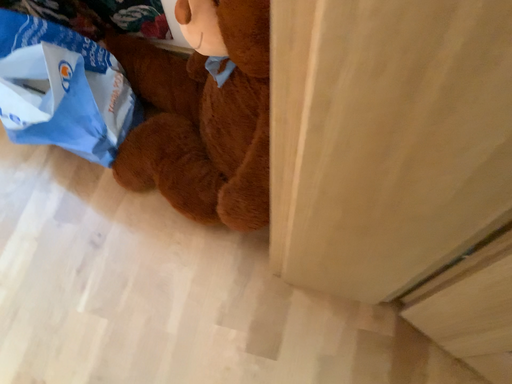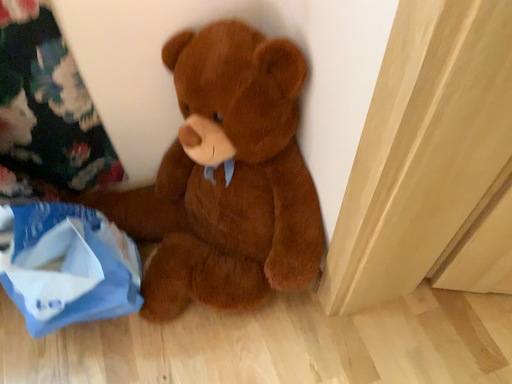
Question: Which way did the camera rotate in the video?

Choices:
 (A) rotated right
 (B) rotated left

Answer: (A)